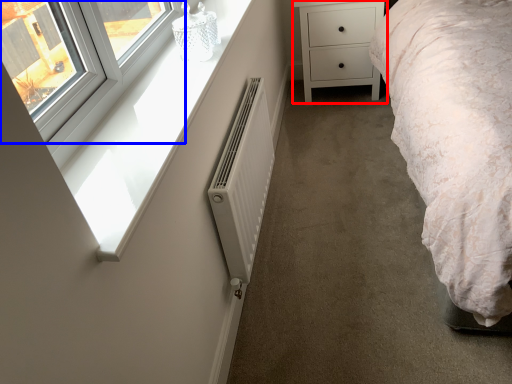
Question: Which of the following is the closest to the observer, chest of drawers (highlighted by a red box) or window (highlighted by a blue box)?

Choices:
 (A) chest of drawers
 (B) window

Answer: (B)